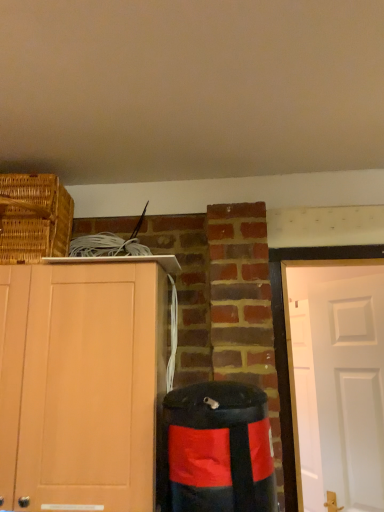
Question: Does black matte waste container at lower right appear on the left side of light wood cabinet at left?

Choices:
 (A) no
 (B) yes

Answer: (A)

Question: Does black matte waste container at lower right turn towards light wood cabinet at left?

Choices:
 (A) no
 (B) yes

Answer: (A)

Question: Can you confirm if black matte waste container at lower right is taller than light wood cabinet at left?

Choices:
 (A) no
 (B) yes

Answer: (A)

Question: From a real-world perspective, is black matte waste container at lower right physically below light wood cabinet at left?

Choices:
 (A) no
 (B) yes

Answer: (B)

Question: Considering the relative sizes of black matte waste container at lower right and light wood cabinet at left in the image provided, is black matte waste container at lower right thinner than light wood cabinet at left?

Choices:
 (A) yes
 (B) no

Answer: (A)

Question: From the image's perspective, does black matte waste container at lower right appear higher than light wood cabinet at left?

Choices:
 (A) no
 (B) yes

Answer: (A)

Question: Can you confirm if woven brown basket at upper left is smaller than black matte waste container at lower right?

Choices:
 (A) no
 (B) yes

Answer: (A)

Question: From the image's perspective, does woven brown basket at upper left appear lower than black matte waste container at lower right?

Choices:
 (A) yes
 (B) no

Answer: (B)

Question: Considering the relative sizes of woven brown basket at upper left and black matte waste container at lower right in the image provided, is woven brown basket at upper left bigger than black matte waste container at lower right?

Choices:
 (A) yes
 (B) no

Answer: (A)

Question: Is woven brown basket at upper left turned away from black matte waste container at lower right?

Choices:
 (A) no
 (B) yes

Answer: (A)

Question: Does woven brown basket at upper left appear on the right side of black matte waste container at lower right?

Choices:
 (A) yes
 (B) no

Answer: (B)

Question: Is woven brown basket at upper left with black matte waste container at lower right?

Choices:
 (A) no
 (B) yes

Answer: (A)

Question: Is black matte waste container at lower right surrounded by light wood cabinet at left?

Choices:
 (A) no
 (B) yes

Answer: (A)